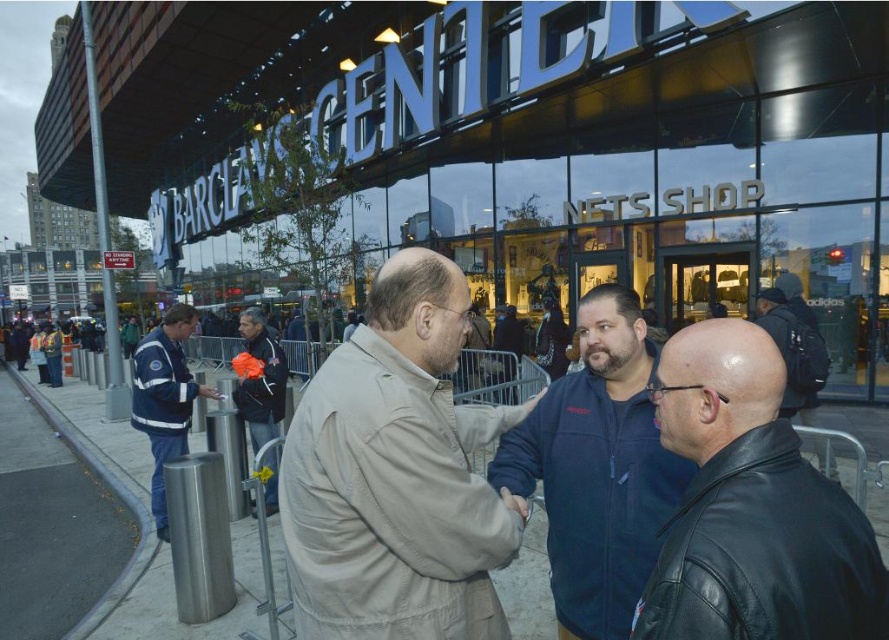
Where is the beige fabric jacket at center located in the image?

The beige fabric jacket at center is located at point 0.742 on the x axis and 0.447 on the y axis.

You are a photographer trying to capture a group photo of the beige fabric jacket at center and the blue reflective jacket at left. Since you want both jackets to appear the same size in the photo, which direction should you move your camera? Explain your reasoning.

The beige fabric jacket at center is larger in size than the blue reflective jacket at left. To make them appear the same size in the photo, you should move the camera closer to the blue reflective jacket at left and farther from the beige fabric jacket at center. This way, the smaller blue reflective jacket at left will appear larger in the frame, while the larger beige fabric jacket at center will appear smaller.